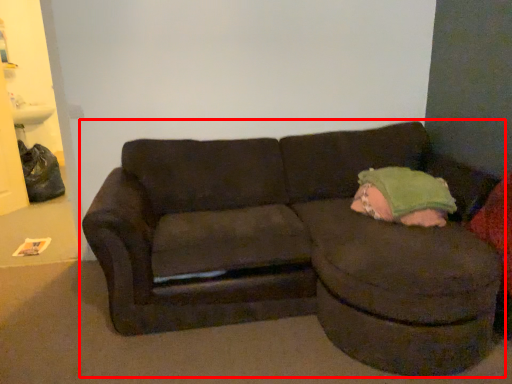
Question: From the image's perspective, where is studio couch (annotated by the red box) located relative to toddler?

Choices:
 (A) below
 (B) above

Answer: (A)